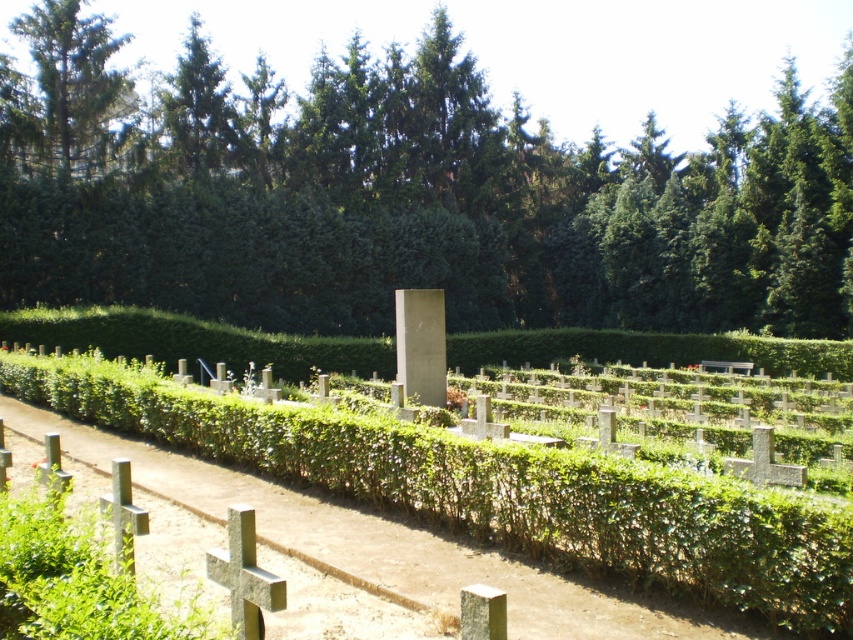
Question: Can you confirm if green leafy tree at center is positioned to the right of green textured tree at upper left?

Choices:
 (A) no
 (B) yes

Answer: (B)

Question: Among these objects, which one is nearest to the camera?

Choices:
 (A) green textured tree at upper left
 (B) green leafy tree at center
 (C) green hedge at center

Answer: (C)

Question: Among these points, which one is farthest from the camera?

Choices:
 (A) (573, 582)
 (B) (105, 22)
 (C) (7, 99)

Answer: (B)

Question: Does green leafy tree at center appear under green hedge at center?

Choices:
 (A) yes
 (B) no

Answer: (B)

Question: Does green leafy tree at center come behind green hedge at center?

Choices:
 (A) no
 (B) yes

Answer: (B)

Question: Among these objects, which one is farthest from the camera?

Choices:
 (A) green hedge at center
 (B) green textured tree at upper left
 (C) green leafy tree at center

Answer: (B)